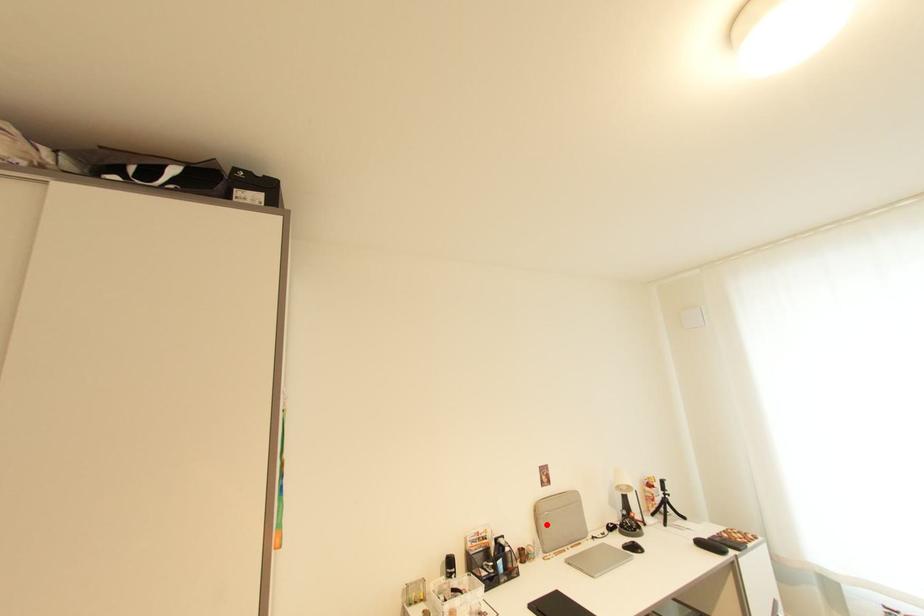
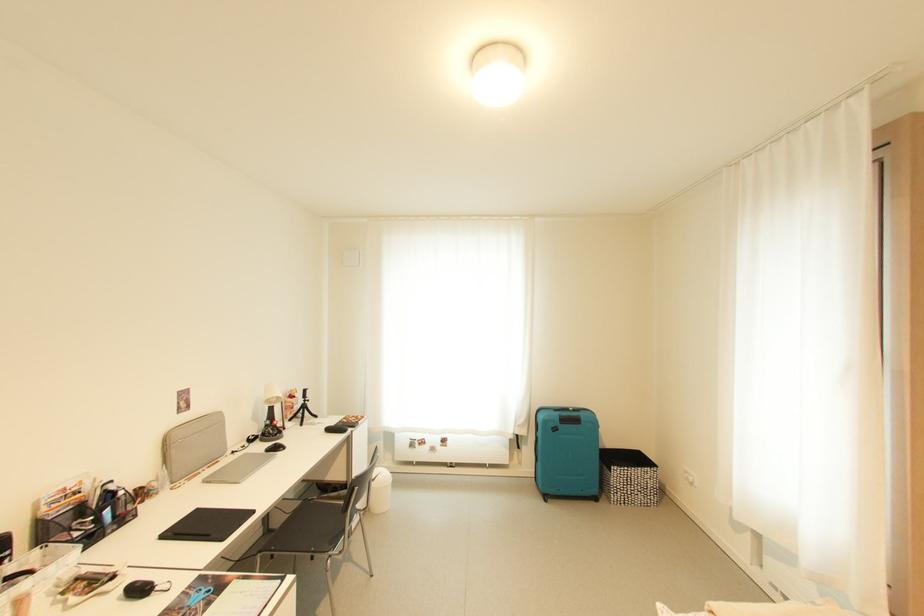
Find the pixel in the second image that matches the highlighted location in the first image.

(177, 455)